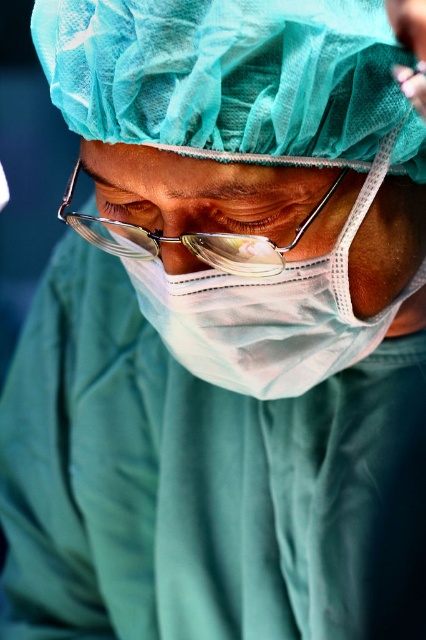
Question: Which point is farther from the camera taking this photo?

Choices:
 (A) (359, 205)
 (B) (261, 262)

Answer: (B)

Question: Which point is closer to the camera?

Choices:
 (A) metallic wire frame glasses at center
 (B) white matte mask at center

Answer: (B)

Question: In this image, where is white matte mask at center located relative to metallic wire frame glasses at center?

Choices:
 (A) left
 (B) right

Answer: (B)

Question: Observing the image, what is the correct spatial positioning of white matte mask at center in reference to metallic wire frame glasses at center?

Choices:
 (A) left
 (B) right

Answer: (B)

Question: Does white matte mask at center have a greater width compared to metallic wire frame glasses at center?

Choices:
 (A) yes
 (B) no

Answer: (A)